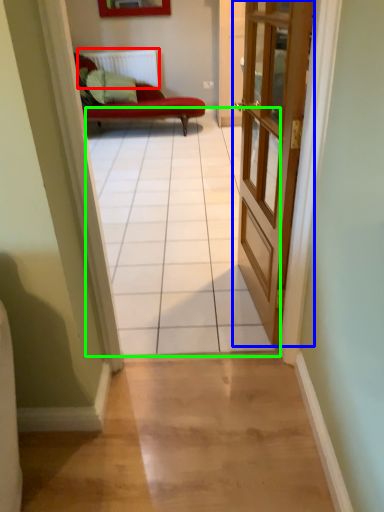
Question: Based on their relative distances, which object is farther from radiator (highlighted by a red box)? Choose from door (highlighted by a blue box) and path (highlighted by a green box).

Choices:
 (A) door
 (B) path

Answer: (A)